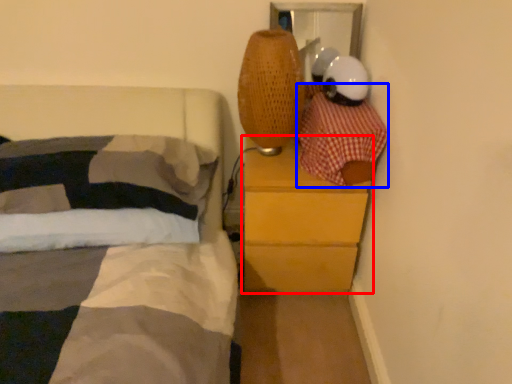
Question: Which point is closer to the camera, chest of drawers (highlighted by a red box) or blanket (highlighted by a blue box)?

Choices:
 (A) chest of drawers
 (B) blanket

Answer: (B)